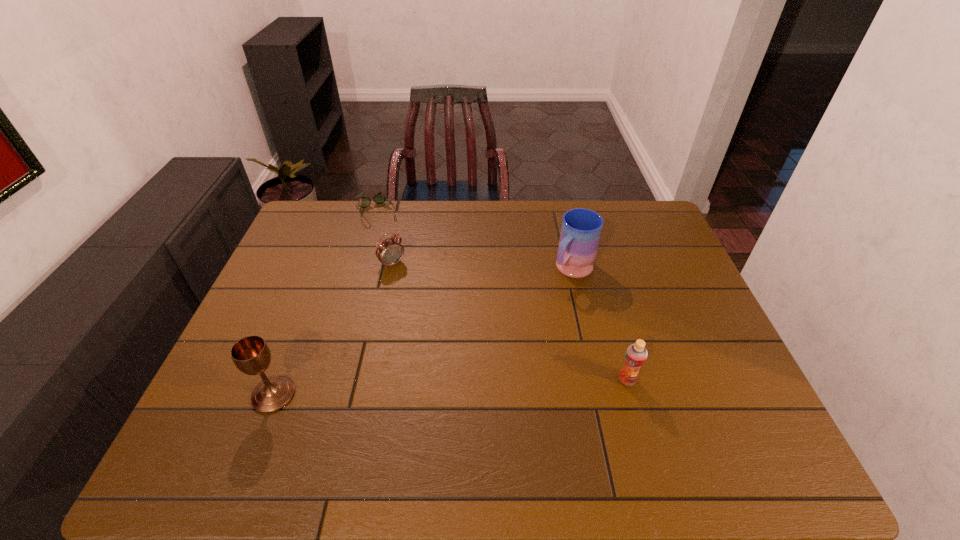
Locate an element on the screen. vacant space located on the face of the alarm clock is located at coordinates (417, 290).

The width and height of the screenshot is (960, 540). What are the coordinates of `vacant region located 0.290m on the front-facing side of the shortest object` in the screenshot? It's located at (409, 277).

Image resolution: width=960 pixels, height=540 pixels. What are the coordinates of `free space located on the front-facing side of the shortest object` in the screenshot? It's located at (396, 254).

The image size is (960, 540). I want to click on blank space located on the front-facing side of the shortest object, so click(401, 263).

Locate an element on the screen. The image size is (960, 540). vacant area located on the side of the mug with the handle is located at coordinates (506, 341).

Find the location of a particular element. free space located on the side of the mug with the handle is located at coordinates (532, 314).

Locate an element on the screen. vacant position located on the side of the mug with the handle is located at coordinates (478, 370).

Where is `object located in the far edge section of the desktop`? object located in the far edge section of the desktop is located at coordinates (379, 198).

Locate an element on the screen. The height and width of the screenshot is (540, 960). object located at the near edge is located at coordinates (251, 355).

Locate an element on the screen. object present at the left edge is located at coordinates (251, 355).